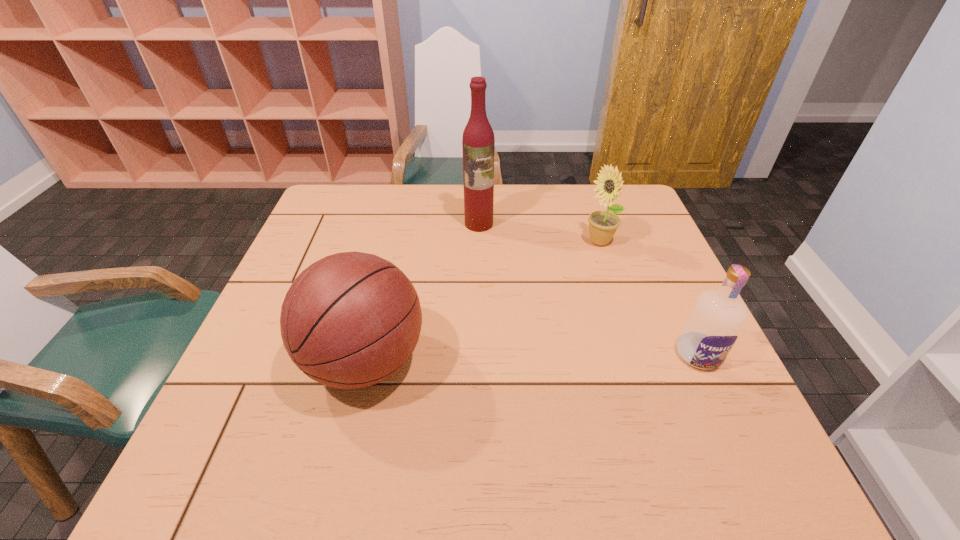
Locate an element on the screen. Image resolution: width=960 pixels, height=540 pixels. free location at the far edge of the desktop is located at coordinates (398, 185).

Where is `free space at the near edge of the desktop`? The width and height of the screenshot is (960, 540). free space at the near edge of the desktop is located at coordinates (379, 410).

Where is `vacant area at the left edge`? vacant area at the left edge is located at coordinates (281, 280).

Find the location of `vacant space at the right edge of the desktop`. vacant space at the right edge of the desktop is located at coordinates (681, 314).

This screenshot has height=540, width=960. In order to click on vacant space at the near right corner in this screenshot , I will do `click(670, 426)`.

Where is `empty space between the vodka and the second object from left to right`? Image resolution: width=960 pixels, height=540 pixels. empty space between the vodka and the second object from left to right is located at coordinates (588, 289).

You are a GUI agent. You are given a task and a screenshot of the screen. Output one action in this format:
    pyautogui.click(x=<x>, y=<y>)
    Task: Click on the free space between the second object from left to right and the sunflower
    The image size is (960, 540).
    Given the screenshot: What is the action you would take?
    pyautogui.click(x=540, y=233)

Where is `unoccupied area between the second object from right to left and the second object from left to right`? The image size is (960, 540). unoccupied area between the second object from right to left and the second object from left to right is located at coordinates (540, 233).

At what (x,y) coordinates should I click in order to perform the action: click on vacant point located between the leftmost object and the vodka. Please return your answer as a coordinate pair (x, y). Image resolution: width=960 pixels, height=540 pixels. Looking at the image, I should click on (532, 358).

Find the location of a particular element. Image resolution: width=960 pixels, height=540 pixels. free space between the basketball and the farthest object is located at coordinates (422, 293).